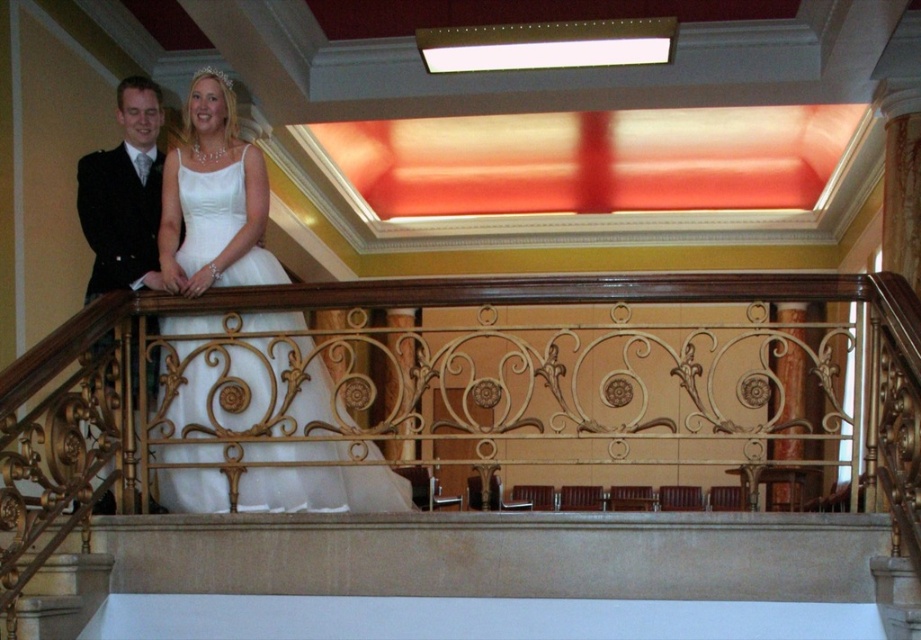
You are a photographer positioned at the origin of the coordinate system in the grand hall. You need to capture a closeup shot of the white satin dress at center. According to the scene description, where should you aim your camera to ensure the dress is centered in the frame?

You should aim your camera at the coordinate point (x=323, y=490) to center the white satin dress at center in the frame.

You are a photographer positioned at the bottom of the staircase. You need to capture a photo of both the white satin dress at center and the black satin suit at left. Which one will appear larger in the photo?

The white satin dress at center will appear larger in the photo because it is closer to the viewer than the black satin suit at left.

You are a photographer positioned at the camera. You want to take a closeup shot of the white satin dress at center. Currently, you are 5.10 meters away from it. The camera has a zoom lens that can magnify objects up to 2x. Will you be able to capture the dress in detail without moving closer?

The white satin dress at center is 5.10 meters from the camera. Since the camera has a zoom lens capable of 2x magnification, you can capture the dress in detail without moving closer, as the distance is within the lens range.